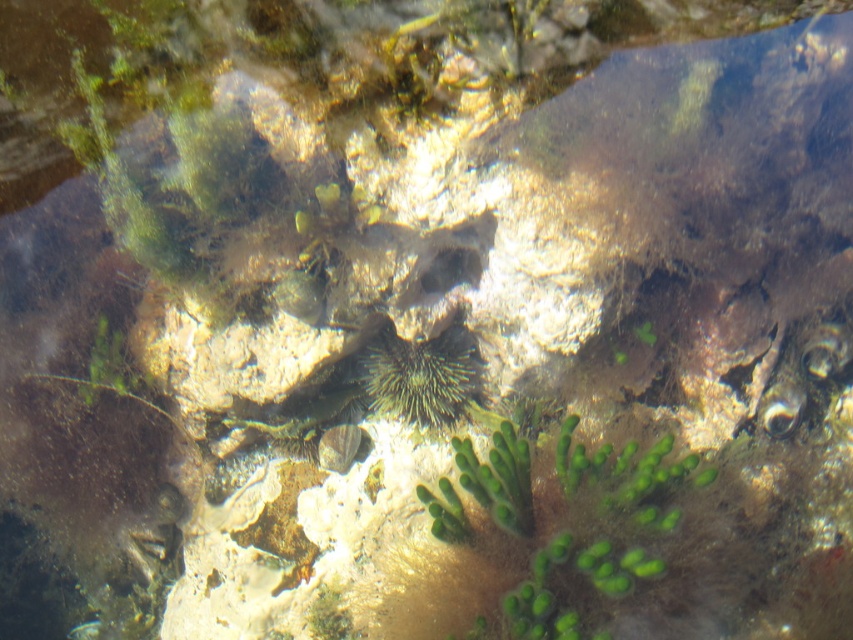
Question: Is green fuzzy algae at center bigger than green spiny at center?

Choices:
 (A) yes
 (B) no

Answer: (A)

Question: Is the position of green fuzzy algae at center less distant than that of green spiny at center?

Choices:
 (A) no
 (B) yes

Answer: (B)

Question: Is the position of green fuzzy algae at center more distant than that of green spiny at center?

Choices:
 (A) no
 (B) yes

Answer: (A)

Question: Which point is closer to the camera?

Choices:
 (A) (534, 529)
 (B) (474, 362)

Answer: (A)